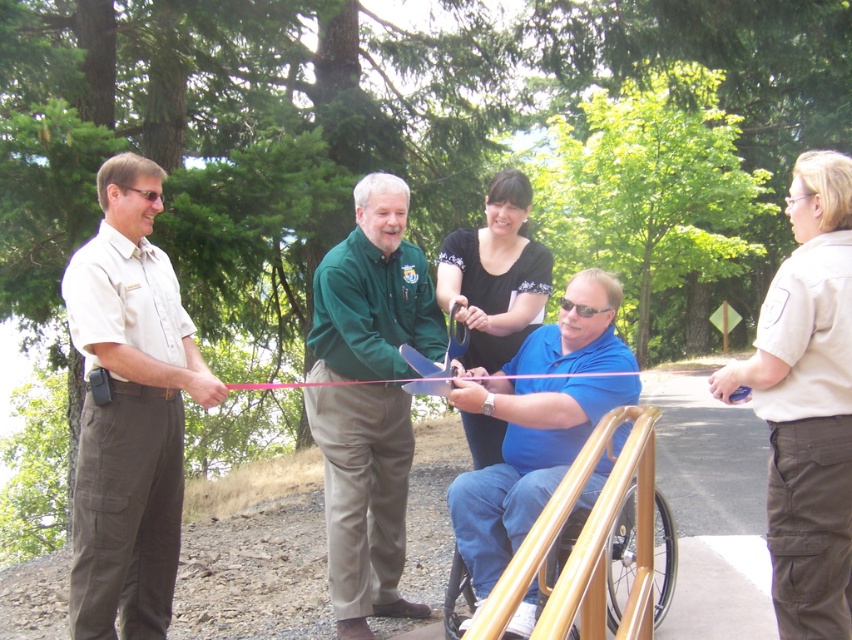
Can you confirm if tan uniform at right is smaller than black matte shirt at center?

Incorrect, tan uniform at right is not smaller in size than black matte shirt at center.

In the scene shown: Can you confirm if tan uniform at right is positioned above black matte shirt at center?

Incorrect, tan uniform at right is not positioned above black matte shirt at center.

The image size is (852, 640). In order to click on tan uniform at right in this screenshot , I will do `click(807, 403)`.

Does tan uniform at right appear over wooden textured wheelchair at lower center?

Yes, tan uniform at right is above wooden textured wheelchair at lower center.

From the picture: Can you confirm if tan uniform at right is taller than wooden textured wheelchair at lower center?

Yes.

Is point (815, 292) positioned after point (533, 618)?

No, (815, 292) is in front of (533, 618).

I want to click on tan uniform at right, so click(807, 403).

Identify the location of khaki uniform pants at left. This screenshot has height=640, width=852. (130, 412).

Looking at this image, who is more forward, (130, 323) or (325, 444)?

Point (130, 323) is in front.

Identify the location of khaki uniform pants at left. The width and height of the screenshot is (852, 640). (130, 412).